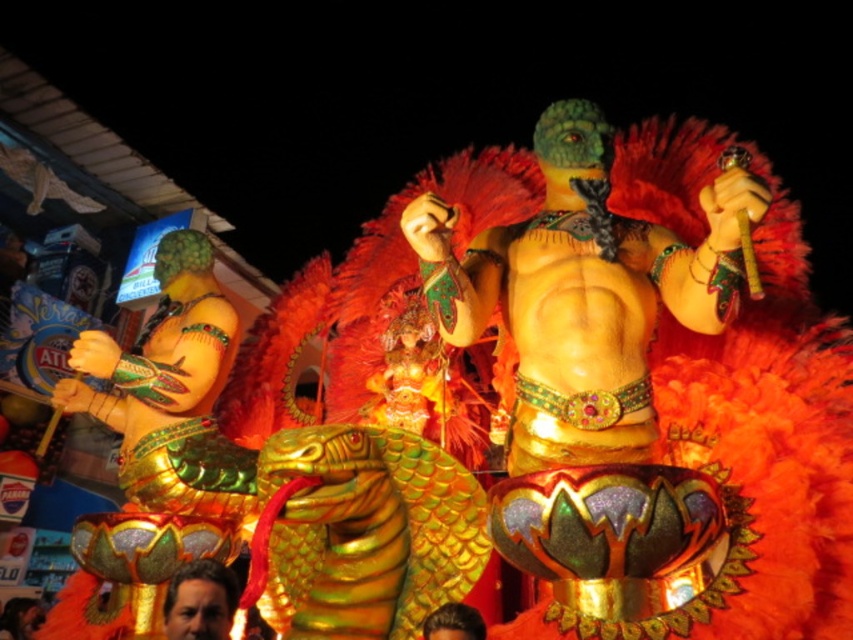
Does shiny gold statue at center appear over brown hair at center?

Yes, shiny gold statue at center is above brown hair at center.

Find the location of `shiny gold statue at center`. shiny gold statue at center is located at coordinates (592, 369).

Can you confirm if shiny gold statue at center is taller than smooth skin face at lower left?

Correct, shiny gold statue at center is much taller as smooth skin face at lower left.

Which of these two, shiny gold statue at center or smooth skin face at lower left, stands shorter?

With less height is smooth skin face at lower left.

This screenshot has height=640, width=853. Identify the location of shiny gold statue at center. (592, 369).

Between point (222, 586) and point (460, 636), which one is positioned in front?

Point (460, 636) is more forward.

How much distance is there between smooth skin face at lower left and brown hair at center?

smooth skin face at lower left is 53.13 feet from brown hair at center.

Between point (223, 582) and point (444, 611), which one is positioned behind?

The point (223, 582) is more distant.

Where is `smooth skin face at lower left`? smooth skin face at lower left is located at coordinates (200, 602).